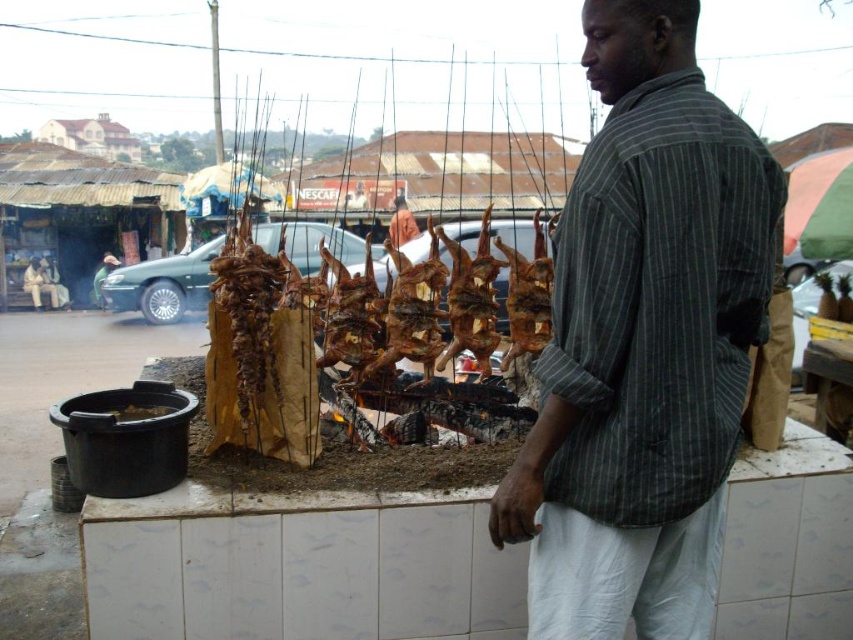
You are a food delivery person who needs to pick up the brown crispy chicken at center and the matte brown shirt at center. The delivery requires you to carry both items simultaneously. However, your carrying capacity is limited to 30 feet between the items. Can you safely carry both items without exceeding your capacity?

The distance between the brown crispy chicken at center and the matte brown shirt at center is 40.38 feet, which exceeds your carrying capacity of 30 feet. Therefore, you cannot safely carry both items simultaneously.

You are standing at the camera position and want to throw a paper ball to the point marked as point [509,246]. Can you estimate how far you need to throw the paper ball?

The distance of point [509,246] from camera is 8.05 meters, so you need to throw the paper ball approximately 8.05 meters.